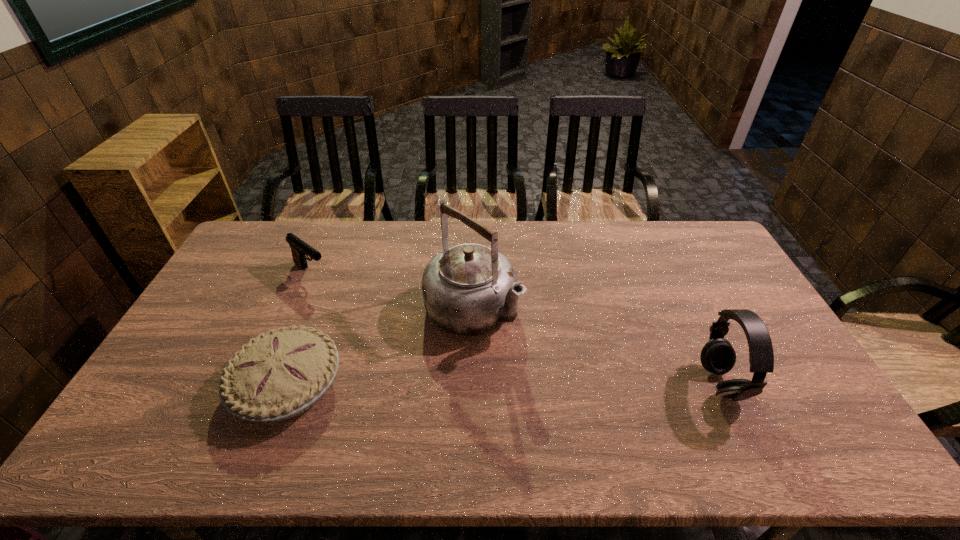
Where is `the shortest object`? the shortest object is located at coordinates (278, 375).

Image resolution: width=960 pixels, height=540 pixels. Find the location of `earphone`. earphone is located at coordinates (718, 356).

Where is `the third shortest object`? This screenshot has height=540, width=960. the third shortest object is located at coordinates (718, 356).

At what (x,y) coordinates should I click in order to perform the action: click on pistol. Please return your answer as a coordinate pair (x, y). The width and height of the screenshot is (960, 540). Looking at the image, I should click on (299, 248).

This screenshot has height=540, width=960. What are the coordinates of `kettle` in the screenshot? It's located at (470, 289).

Locate an element on the screen. The width and height of the screenshot is (960, 540). the tallest object is located at coordinates (470, 289).

Where is `free region located on the right of the pie`? The height and width of the screenshot is (540, 960). free region located on the right of the pie is located at coordinates [391, 384].

Where is `free region located 0.340m on the ear cups of the second tallest object`? This screenshot has height=540, width=960. free region located 0.340m on the ear cups of the second tallest object is located at coordinates (576, 383).

Locate an element on the screen. vacant space located 0.260m on the ear cups of the second tallest object is located at coordinates (606, 383).

At what (x,y) coordinates should I click in order to perform the action: click on vacant region located on the ear cups of the second tallest object. Please return your answer as a coordinate pair (x, y). This screenshot has width=960, height=540. Looking at the image, I should click on [665, 383].